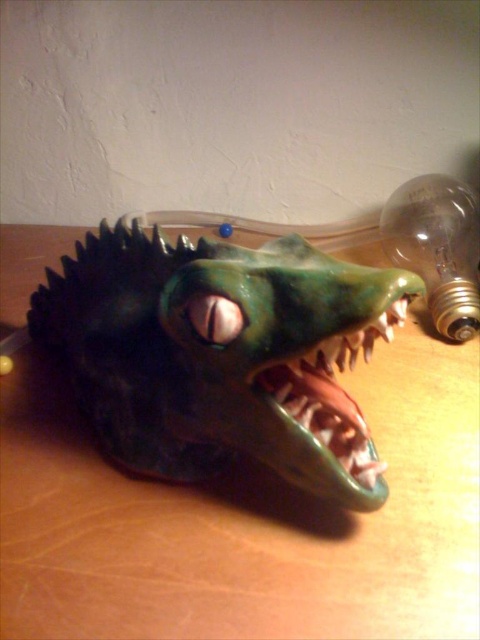
Who is lower down, green matte crocodile head at center or shiny metallic teeth at center?

Positioned lower is shiny metallic teeth at center.

Can you confirm if green matte crocodile head at center is smaller than shiny metallic teeth at center?

Actually, green matte crocodile head at center might be larger than shiny metallic teeth at center.

Measure the distance between point [169,433] and camera.

They are 1.06 meters apart.

In order to click on green matte crocodile head at center in this screenshot , I will do `click(223, 355)`.

Image resolution: width=480 pixels, height=640 pixels. Find the location of `green matte crocodile head at center`. green matte crocodile head at center is located at coordinates (223, 355).

Is point (239, 298) farther from camera compared to point (437, 260)?

That is False.

Identify the location of green matte crocodile head at center. The image size is (480, 640). click(x=223, y=355).

Does translucent glass bulb at upper right have a smaller size compared to shiny metallic teeth at center?

Actually, translucent glass bulb at upper right might be larger than shiny metallic teeth at center.

At what (x,y) coordinates should I click in order to perform the action: click on translucent glass bulb at upper right. Please return your answer as a coordinate pair (x, y). Looking at the image, I should click on (437, 248).